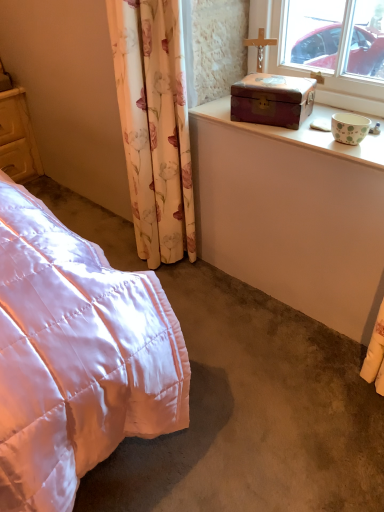
Question: Is wooden box at upper right facing towards wooden chest at upper right?

Choices:
 (A) yes
 (B) no

Answer: (B)

Question: Can you confirm if wooden box at upper right is wider than wooden chest at upper right?

Choices:
 (A) no
 (B) yes

Answer: (A)

Question: Is wooden box at upper right positioned behind wooden chest at upper right?

Choices:
 (A) yes
 (B) no

Answer: (A)

Question: Can you confirm if wooden box at upper right is thinner than wooden chest at upper right?

Choices:
 (A) yes
 (B) no

Answer: (A)

Question: Is wooden box at upper right placed right next to wooden chest at upper right?

Choices:
 (A) no
 (B) yes

Answer: (B)

Question: Considering the relative positions of wooden box at upper right and wooden chest at upper right in the image provided, is wooden box at upper right to the right of wooden chest at upper right from the viewer's perspective?

Choices:
 (A) no
 (B) yes

Answer: (A)

Question: Is there a large distance between wooden chest at upper right and wooden box at upper right?

Choices:
 (A) no
 (B) yes

Answer: (A)

Question: From the image's perspective, is wooden chest at upper right located above wooden box at upper right?

Choices:
 (A) yes
 (B) no

Answer: (B)

Question: Can wooden box at upper right be found inside wooden chest at upper right?

Choices:
 (A) no
 (B) yes

Answer: (A)

Question: Is wooden chest at upper right closer to camera compared to wooden box at upper right?

Choices:
 (A) yes
 (B) no

Answer: (A)

Question: Can you confirm if wooden chest at upper right is wider than wooden box at upper right?

Choices:
 (A) yes
 (B) no

Answer: (A)

Question: Can you confirm if wooden chest at upper right is smaller than wooden box at upper right?

Choices:
 (A) yes
 (B) no

Answer: (B)

Question: From the image's perspective, does wooden box at upper right appear lower than matte yellow wooden cupboard at left?

Choices:
 (A) yes
 (B) no

Answer: (A)